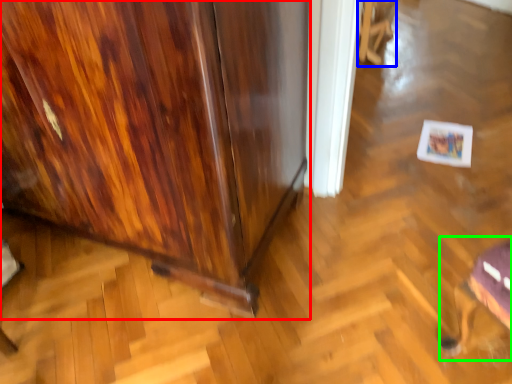
Question: Estimate the real-world distances between objects in this image. Which object is closer to furniture (highlighted by a red box), swivel chair (highlighted by a blue box) or swivel chair (highlighted by a green box)?

Choices:
 (A) swivel chair
 (B) swivel chair

Answer: (B)